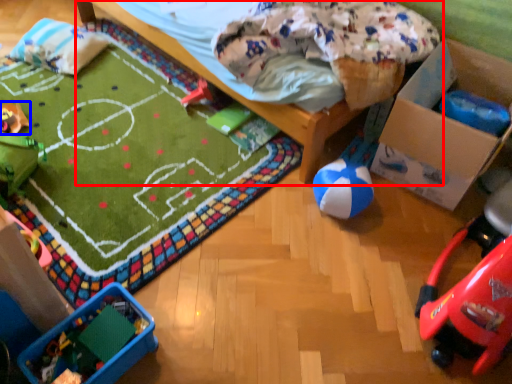
Question: Which object appears farthest to the camera in this image, furniture (highlighted by a red box) or toy (highlighted by a blue box)?

Choices:
 (A) furniture
 (B) toy

Answer: (B)